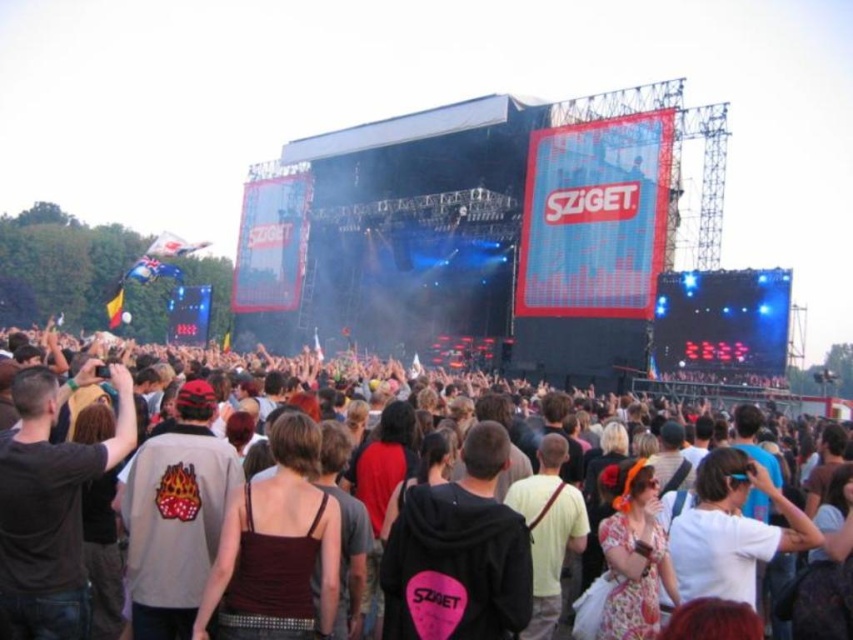
Question: Is brown fabric crowd at center wider than dark brown fabric tank top at center?

Choices:
 (A) yes
 (B) no

Answer: (A)

Question: Is brown fabric crowd at center smaller than dark brown fabric tank top at center?

Choices:
 (A) no
 (B) yes

Answer: (A)

Question: Can you confirm if brown fabric crowd at center is positioned to the left of dark brown fabric tank top at center?

Choices:
 (A) no
 (B) yes

Answer: (A)

Question: Which point is closer to the camera?

Choices:
 (A) brown fabric crowd at center
 (B) dark brown fabric tank top at center

Answer: (A)